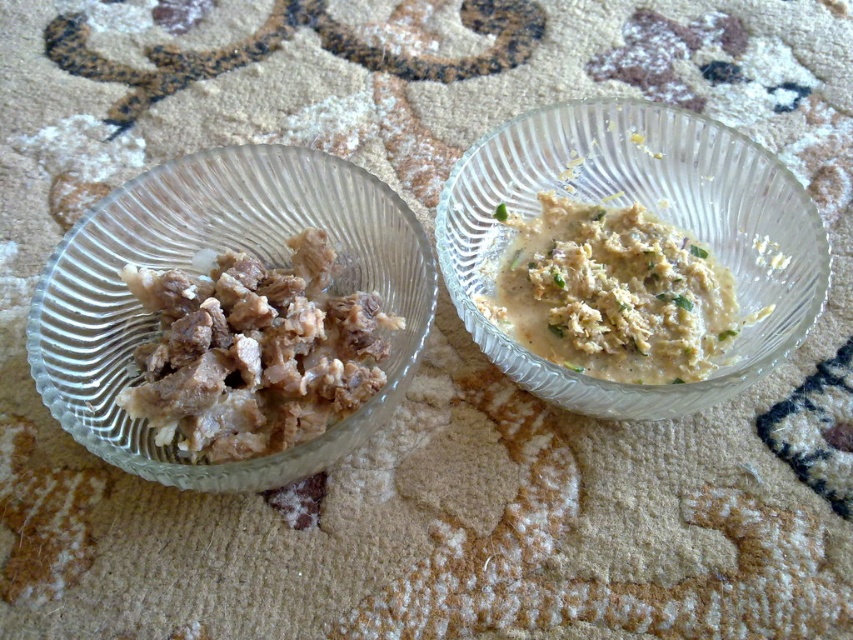
You are standing in a room with two glass bowls on a carpet. You need to place a small spoon exactly at the point with coordinates point (653, 212). Which bowl should you place the spoon on?

The point (653, 212) is on the clear glass bowl at upper right, so you should place the spoon on the clear glass bowl at upper right.

You are arranging a buffet table and need to place the clear glass bowl at upper right and the brown meat at left in a specific order. According to the image, which object is positioned to the right of the other?

The clear glass bowl at upper right is positioned to the right of the brown meat at left.

You are holding a small drone that is 30 centimeters wide. You want to fly it from your current position to the point marked at coordinates point (283,173). Can the drone safely land at that point without hitting any objects?

The point point (283,173) is 56.25 centimeters from the camera, so the drone can safely land there as it is farther than the drone width of 30 centimeters.